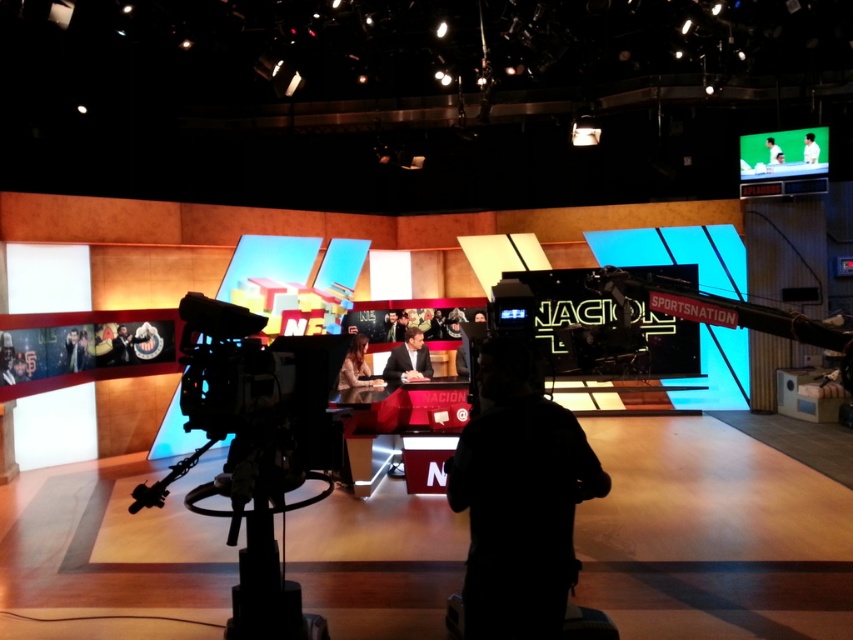
Question: Which of the following is the closest to the observer?

Choices:
 (A) (770, 148)
 (B) (405, 346)
 (C) (770, 163)
 (D) (804, 136)

Answer: (B)

Question: Does smooth black suit at lower left have a greater width compared to matte black suit at left?

Choices:
 (A) no
 (B) yes

Answer: (A)

Question: Does green matte projection screen at upper right have a smaller size compared to dark suit at center?

Choices:
 (A) no
 (B) yes

Answer: (B)

Question: Which of the following is the closest to the observer?

Choices:
 (A) (299, 582)
 (B) (807, 134)

Answer: (A)

Question: Among these points, which one is nearest to the camera?

Choices:
 (A) (65, 342)
 (B) (366, 344)
 (C) (758, 148)

Answer: (A)

Question: Is black matte person at center below green matte projection screen at upper right?

Choices:
 (A) yes
 (B) no

Answer: (A)